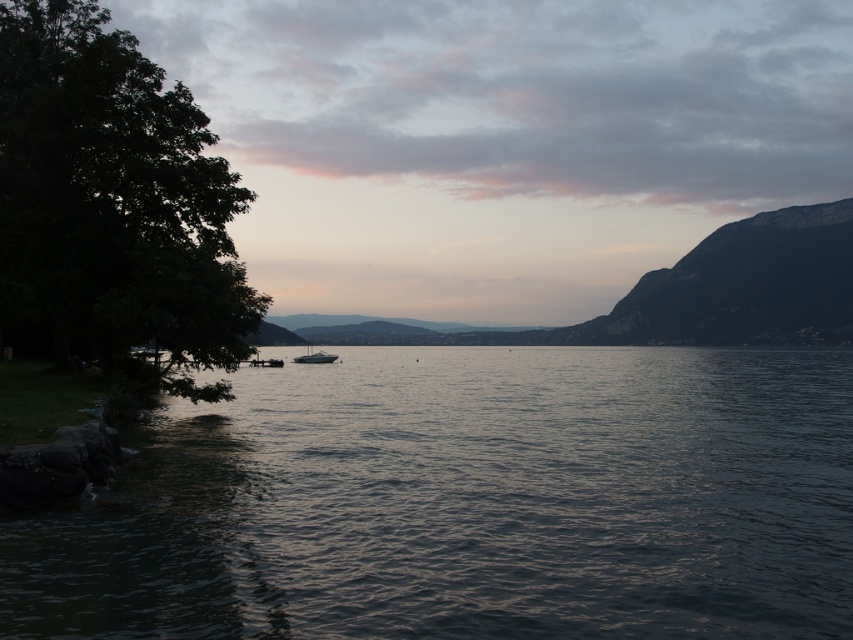
Does point (509, 428) come in front of point (308, 349)?

Yes, point (509, 428) is closer to viewer.

Can you confirm if dark water at center is wider than shiny silver boat at center?

Indeed, dark water at center has a greater width compared to shiny silver boat at center.

Find the location of a particular element. Image resolution: width=853 pixels, height=640 pixels. dark water at center is located at coordinates 468,502.

In the scene shown: Is dark green leafy tree at left wider than shiny silver boat at center?

Yes, dark green leafy tree at left is wider than shiny silver boat at center.

The height and width of the screenshot is (640, 853). What are the coordinates of `dark green leafy tree at left` in the screenshot? It's located at (113, 200).

Can you confirm if dark water at center is positioned below dark green leafy tree at left?

Indeed, dark water at center is positioned under dark green leafy tree at left.

Can you confirm if dark water at center is shorter than dark green leafy tree at left?

Indeed, dark water at center has a lesser height compared to dark green leafy tree at left.

The width and height of the screenshot is (853, 640). Identify the location of dark water at center. (468, 502).

Locate an element on the screen. This screenshot has height=640, width=853. dark water at center is located at coordinates (468, 502).